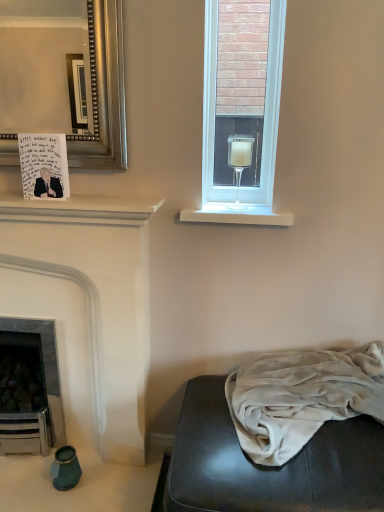
Identify the location of velvety gray blanket at lower right. (302, 397).

I want to click on velvet gray studio couch at lower right, so click(x=270, y=467).

What do you see at coordinates (270, 467) in the screenshot? I see `velvet gray studio couch at lower right` at bounding box center [270, 467].

This screenshot has height=512, width=384. What do you see at coordinates (44, 165) in the screenshot?
I see `handwritten paper postcard at upper left` at bounding box center [44, 165].

The height and width of the screenshot is (512, 384). What are the coordinates of `white smooth window sill at upper right` in the screenshot? It's located at (237, 215).

At what (x,y) coordinates should I click in order to perform the action: click on fireplace below the clear glass candle at upper center (from a real-world perspective). Please return your answer as a coordinate pair (x, y). Looking at the image, I should click on (87, 306).

In the image, is white matte fireplace at left on the left side or the right side of clear glass candle at upper center?

Based on their positions, white matte fireplace at left is located to the left of clear glass candle at upper center.

From the image's perspective, which one is positioned lower, white matte fireplace at left or clear glass candle at upper center?

white matte fireplace at left is shown below in the image.

Which of these two, white matte fireplace at left or clear glass candle at upper center, stands taller?

white matte fireplace at left is taller.

Is there a large distance between clear glass candle at upper center and white smooth window sill at upper right?

That's not correct — clear glass candle at upper center is a little close to white smooth window sill at upper right.

In the scene shown: How different are the orientations of clear glass candle at upper center and white smooth window sill at upper right in degrees?

0.579 degrees.

Who is bigger, clear glass candle at upper center or white smooth window sill at upper right?

Bigger between the two is clear glass candle at upper center.

From a real-world perspective, is handwritten paper postcard at upper left below white smooth window sill at upper right?

No, from a real-world perspective, handwritten paper postcard at upper left is not below white smooth window sill at upper right.

Consider the image. Are handwritten paper postcard at upper left and white smooth window sill at upper right beside each other?

handwritten paper postcard at upper left and white smooth window sill at upper right are not in contact.

How much distance is there between handwritten paper postcard at upper left and white smooth window sill at upper right?

handwritten paper postcard at upper left is 20.66 inches from white smooth window sill at upper right.

Can you confirm if handwritten paper postcard at upper left is smaller than white smooth window sill at upper right?

Yes.

From a real-world perspective, is velvety gray blanket at lower right positioned above or below clear glass wine glass at upper right?

velvety gray blanket at lower right is below clear glass wine glass at upper right.

Is velvety gray blanket at lower right to the right of clear glass wine glass at upper right from the viewer's perspective?

Correct, you'll find velvety gray blanket at lower right to the right of clear glass wine glass at upper right.

Image resolution: width=384 pixels, height=512 pixels. Identify the location of blanket that is in front of the clear glass wine glass at upper right. (302, 397).

Considering the sizes of objects velvety gray blanket at lower right and clear glass wine glass at upper right in the image provided, who is smaller, velvety gray blanket at lower right or clear glass wine glass at upper right?

clear glass wine glass at upper right.

Visually, is velvety gray blanket at lower right positioned to the left or to the right of white matte shelf at upper left?

In the image, velvety gray blanket at lower right appears on the right side of white matte shelf at upper left.

Is velvety gray blanket at lower right spatially inside white matte shelf at upper left, or outside of it?

The correct answer is: outside.

From the image's perspective, is velvety gray blanket at lower right under white matte shelf at upper left?

Yes, from the image's perspective, velvety gray blanket at lower right is below white matte shelf at upper left.

Which of these two, white matte fireplace at left or velvety gray blanket at lower right, stands shorter?

velvety gray blanket at lower right.

How far apart are white matte fireplace at left and velvety gray blanket at lower right?

A distance of 24.68 inches exists between white matte fireplace at left and velvety gray blanket at lower right.

From the image's perspective, is white matte fireplace at left above or below velvety gray blanket at lower right?

Based on their image positions, white matte fireplace at left is located above velvety gray blanket at lower right.

I want to click on fireplace located on the left of velvety gray blanket at lower right, so click(87, 306).

Find the location of a particular element. The width and height of the screenshot is (384, 512). wine glass that is on the right side of white smooth window sill at upper right is located at coordinates (239, 159).

Consider the image. Is white smooth window sill at upper right far away from clear glass wine glass at upper right?

Yes, white smooth window sill at upper right and clear glass wine glass at upper right are quite far apart.

Is point (273, 218) closer or farther from the camera than point (237, 205)?

Clearly, point (273, 218) is closer to the camera than point (237, 205).

Is white smooth window sill at upper right positioned before clear glass wine glass at upper right?

Yes, it is in front of clear glass wine glass at upper right.

Locate an element on the screen. The width and height of the screenshot is (384, 512). fireplace lying in front of the clear glass candle at upper center is located at coordinates (87, 306).

What are the coordinates of `window sill to the left of clear glass candle at upper center` in the screenshot? It's located at (237, 215).

When comparing their distances from handwritten paper postcard at upper left, does white smooth window sill at upper right or velvet gray studio couch at lower right seem closer?

white smooth window sill at upper right lies closer to handwritten paper postcard at upper left than the other object.

Looking at the image, which one is located closer to clear glass candle at upper center, clear glass wine glass at upper right or handwritten paper postcard at upper left?

handwritten paper postcard at upper left.

Considering their positions, is white matte fireplace at left positioned further to velvet gray studio couch at lower right than white smooth window sill at upper right?

white smooth window sill at upper right is further to velvet gray studio couch at lower right.

Which object lies further to the anchor point white matte fireplace at left, white matte shelf at upper left or handwritten paper postcard at upper left?

handwritten paper postcard at upper left is positioned further to the anchor white matte fireplace at left.

Which object lies nearer to the anchor point white smooth window sill at upper right, handwritten paper postcard at upper left or white matte fireplace at left?

Among the two, white matte fireplace at left is located nearer to white smooth window sill at upper right.

When comparing their distances from white smooth window sill at upper right, does velvety gray blanket at lower right or clear glass wine glass at upper right seem further?

Based on the image, clear glass wine glass at upper right appears to be further to white smooth window sill at upper right.

Which object lies further to the anchor point clear glass wine glass at upper right, white matte shelf at upper left or velvet gray studio couch at lower right?

The object further to clear glass wine glass at upper right is velvet gray studio couch at lower right.

Which object lies further to the anchor point white matte shelf at upper left, velvet gray studio couch at lower right or clear glass candle at upper center?

velvet gray studio couch at lower right is positioned further to the anchor white matte shelf at upper left.

This screenshot has width=384, height=512. I want to click on window sill between clear glass wine glass at upper right and velvety gray blanket at lower right vertically, so [237, 215].

Identify the location of mantle located between handwritten paper postcard at upper left and clear glass candle at upper center in the left-right direction. Image resolution: width=384 pixels, height=512 pixels. (79, 209).

Locate an element on the screen. Image resolution: width=384 pixels, height=512 pixels. mantle between handwritten paper postcard at upper left and velvet gray studio couch at lower right from top to bottom is located at coordinates (79, 209).

Where is `window sill between clear glass candle at upper center and white matte fireplace at left in the up-down direction`? The width and height of the screenshot is (384, 512). window sill between clear glass candle at upper center and white matte fireplace at left in the up-down direction is located at coordinates (237, 215).